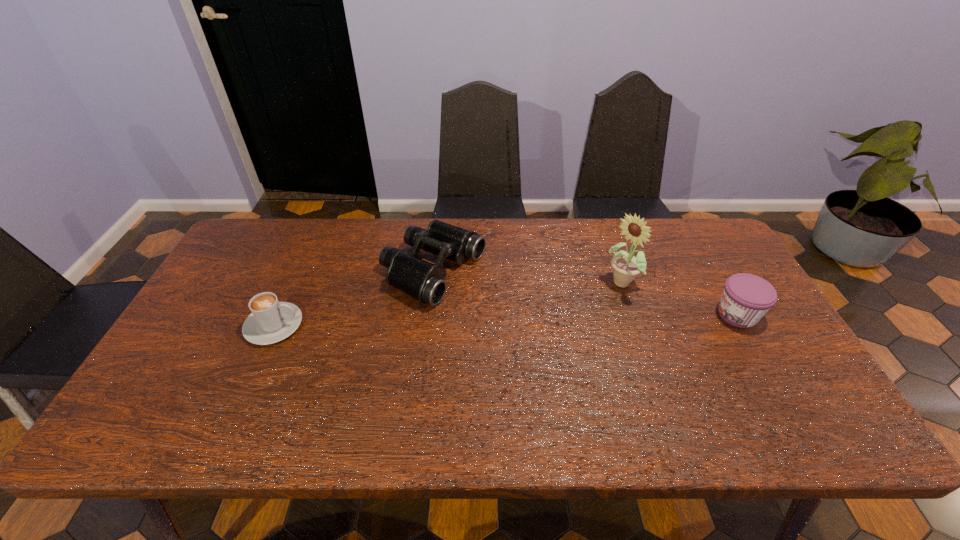
At what (x,y) coordinates should I click in order to perform the action: click on the leftmost object. Please return your answer as a coordinate pair (x, y). This screenshot has height=540, width=960. Looking at the image, I should click on (271, 321).

Where is `jam`? jam is located at coordinates (746, 298).

This screenshot has width=960, height=540. Find the location of `binoculars`. binoculars is located at coordinates (425, 282).

Locate an element on the screen. The width and height of the screenshot is (960, 540). the second object from right to left is located at coordinates (626, 266).

What are the coordinates of `sunflower` in the screenshot? It's located at (626, 266).

Where is `vacant space situated to the right of the cappuccino`? Image resolution: width=960 pixels, height=540 pixels. vacant space situated to the right of the cappuccino is located at coordinates (353, 326).

Where is `blank area located on the front label of the rightmost object`? The height and width of the screenshot is (540, 960). blank area located on the front label of the rightmost object is located at coordinates (588, 315).

Locate an element on the screen. This screenshot has width=960, height=540. vacant space positioned 0.080m on the front label of the rightmost object is located at coordinates (685, 315).

The image size is (960, 540). I want to click on vacant space located 0.360m on the front label of the rightmost object, so click(x=585, y=315).

Find the location of a particular element. The height and width of the screenshot is (540, 960). vacant area situated on the front-facing side of the second object from left to right is located at coordinates (568, 328).